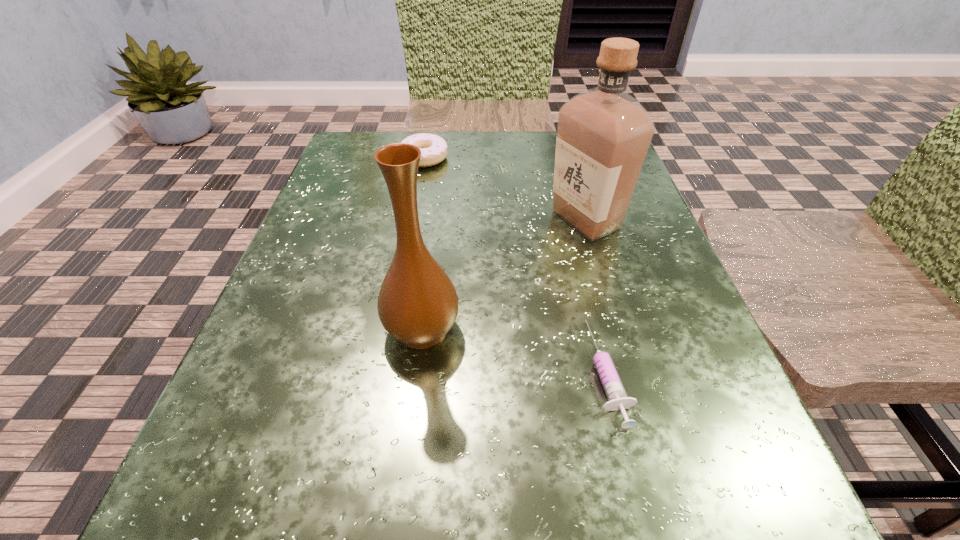
You are a GUI agent. You are given a task and a screenshot of the screen. Output one action in this format:
    pyautogui.click(x=<x>, y=<y>)
    Task: Click on the liquor
    This screenshot has width=960, height=540.
    Given the screenshot: What is the action you would take?
    pyautogui.click(x=603, y=134)

Locate an element on the screen. This screenshot has width=960, height=540. vase is located at coordinates (417, 304).

At what (x,y) coordinates should I click in order to perform the action: click on the farthest object. Please return your answer as a coordinate pair (x, y). The height and width of the screenshot is (540, 960). Looking at the image, I should click on (433, 148).

Locate an element on the screen. This screenshot has height=540, width=960. doughnut is located at coordinates (433, 148).

At what (x,y) coordinates should I click in order to perform the action: click on the taller syringe. Please return your answer as a coordinate pair (x, y). The image size is (960, 540). Looking at the image, I should click on (617, 398).

Image resolution: width=960 pixels, height=540 pixels. I want to click on the right syringe, so click(x=617, y=398).

This screenshot has height=540, width=960. I want to click on vacant space located on the front-facing side of the liquor, so 478,219.

Where is `vacant space situated 0.280m on the front-facing side of the liquor`? vacant space situated 0.280m on the front-facing side of the liquor is located at coordinates (396, 219).

You are a GUI agent. You are given a task and a screenshot of the screen. Output one action in this format:
    pyautogui.click(x=<x>, y=<y>)
    Task: Click on the vacant region located 0.240m on the front-facing side of the liquor
    This screenshot has width=960, height=540.
    Given the screenshot: What is the action you would take?
    pyautogui.click(x=419, y=219)

This screenshot has width=960, height=540. Find the location of `free space located on the right of the vase`. free space located on the right of the vase is located at coordinates (706, 329).